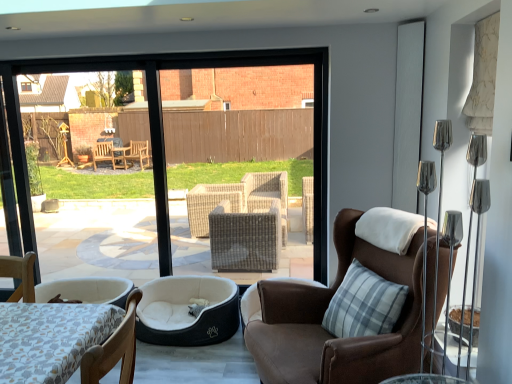
Question: From a real-world perspective, is brown leather chair at center, marked as the first chair in a back-to-front arrangement, under white textured screen door at upper right?

Choices:
 (A) no
 (B) yes

Answer: (B)

Question: Can you confirm if brown leather chair at center, arranged as the 2th chair when viewed from the front, is taller than white textured screen door at upper right?

Choices:
 (A) no
 (B) yes

Answer: (A)

Question: Is brown leather chair at center, arranged as the first chair when viewed from the right, smaller than white textured screen door at upper right?

Choices:
 (A) yes
 (B) no

Answer: (B)

Question: Are brown leather chair at center, marked as the first chair in a back-to-front arrangement, and white textured screen door at upper right far apart?

Choices:
 (A) yes
 (B) no

Answer: (A)

Question: From the image's perspective, is brown leather chair at center, which is counted as the second chair, starting from the left, located above white textured screen door at upper right?

Choices:
 (A) no
 (B) yes

Answer: (A)

Question: Would you say brown leather chair at center, marked as the first chair in a back-to-front arrangement, is inside or outside wooden chair at lower left, the 1th chair in the left-to-right sequence?

Choices:
 (A) outside
 (B) inside

Answer: (A)

Question: Considering the positions of point (251, 350) and point (98, 355), is point (251, 350) closer or farther from the camera than point (98, 355)?

Choices:
 (A) farther
 (B) closer

Answer: (A)

Question: In terms of width, does brown leather chair at center, which is counted as the second chair, starting from the left, look wider or thinner when compared to wooden chair at lower left, the 2th chair positioned from the right?

Choices:
 (A) thin
 (B) wide

Answer: (B)

Question: Considering the relative positions of brown leather chair at center, arranged as the first chair when viewed from the right, and wooden chair at lower left, the 1th chair viewed from the front, in the image provided, is brown leather chair at center, arranged as the first chair when viewed from the right, to the left or to the right of wooden chair at lower left, the 1th chair viewed from the front,?

Choices:
 (A) left
 (B) right

Answer: (B)

Question: Is point (372, 364) closer or farther from the camera than point (167, 329)?

Choices:
 (A) farther
 (B) closer

Answer: (B)

Question: From the image's perspective, is brown leather chair at center, which is counted as the second chair, starting from the left, above or below dark gray plush dog bed at lower left?

Choices:
 (A) above
 (B) below

Answer: (A)

Question: Is brown leather chair at center, which is counted as the second chair, starting from the left, taller or shorter than dark gray plush dog bed at lower left?

Choices:
 (A) short
 (B) tall

Answer: (B)

Question: Is brown leather chair at center, arranged as the first chair when viewed from the right, in front of or behind dark gray plush dog bed at lower left in the image?

Choices:
 (A) behind
 (B) front

Answer: (B)

Question: From a real-world perspective, is wooden chair at lower left, the 1th chair viewed from the front, positioned above or below white textured screen door at upper right?

Choices:
 (A) above
 (B) below

Answer: (B)

Question: Based on their sizes in the image, would you say wooden chair at lower left, the 2th chair positioned from the right, is bigger or smaller than white textured screen door at upper right?

Choices:
 (A) big
 (B) small

Answer: (A)